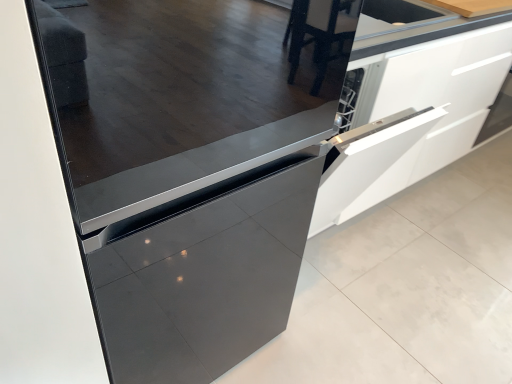
Image resolution: width=512 pixels, height=384 pixels. Find the location of `wooden at upper right`. wooden at upper right is located at coordinates (473, 6).

What do you see at coordinates (473, 6) in the screenshot? Image resolution: width=512 pixels, height=384 pixels. I see `wooden at upper right` at bounding box center [473, 6].

You are a GUI agent. You are given a task and a screenshot of the screen. Output one action in this format:
    pyautogui.click(x=<x>, y=<y>)
    Task: Click on the wooden at upper right
    The width and height of the screenshot is (512, 384).
    Given the screenshot: What is the action you would take?
    pyautogui.click(x=473, y=6)